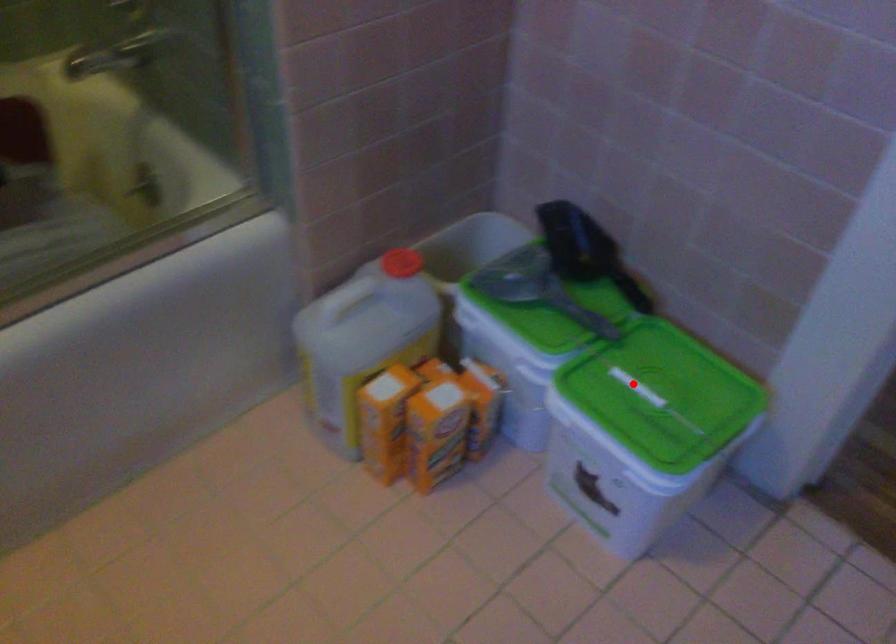
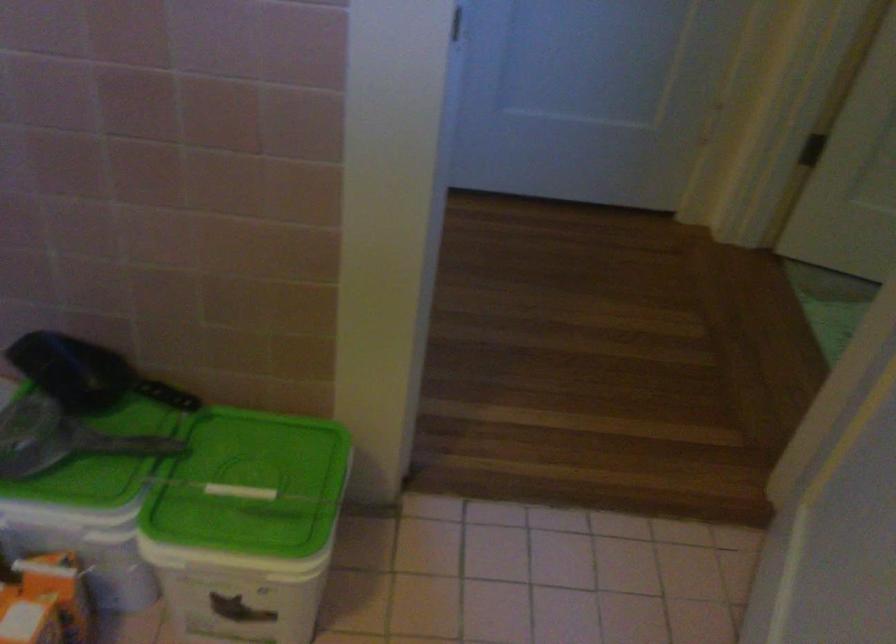
Question: A red point is marked in image1. In image2, is the corresponding 3D point closer to the camera or farther? Reply with the corresponding letter.

Choices:
 (A) The corresponding 3D point is closer.
 (B) The corresponding 3D point is farther.

Answer: (A)